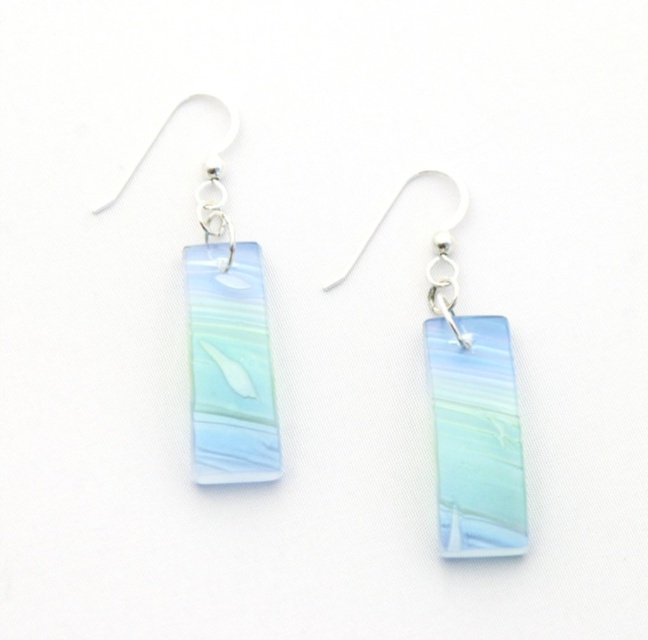
Question: Which point is farther from the camera taking this photo?

Choices:
 (A) (448, 426)
 (B) (260, 344)
 (C) (202, 444)
 (D) (452, 556)

Answer: (B)

Question: Does translucent glass rectangle at left lie behind translucent glass fish at center?

Choices:
 (A) no
 (B) yes

Answer: (B)

Question: Among these points, which one is nearest to the camera?

Choices:
 (A) (244, 456)
 (B) (227, 342)
 (C) (500, 552)

Answer: (C)

Question: Which point appears closest to the camera in this image?

Choices:
 (A) (213, 410)
 (B) (470, 371)
 (C) (174, 113)
 (D) (500, 337)

Answer: (A)

Question: Is the position of translucent glass pendant at center less distant than that of translucent glass fish at center?

Choices:
 (A) yes
 (B) no

Answer: (A)

Question: Can you confirm if translucent glass rectangle at center is wider than translucent glass rectangle at left?

Choices:
 (A) no
 (B) yes

Answer: (B)